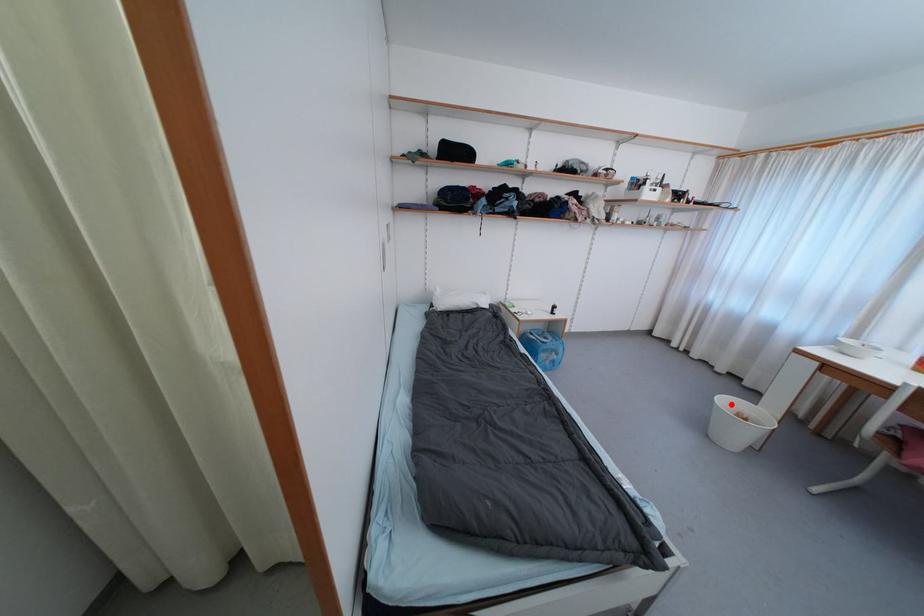
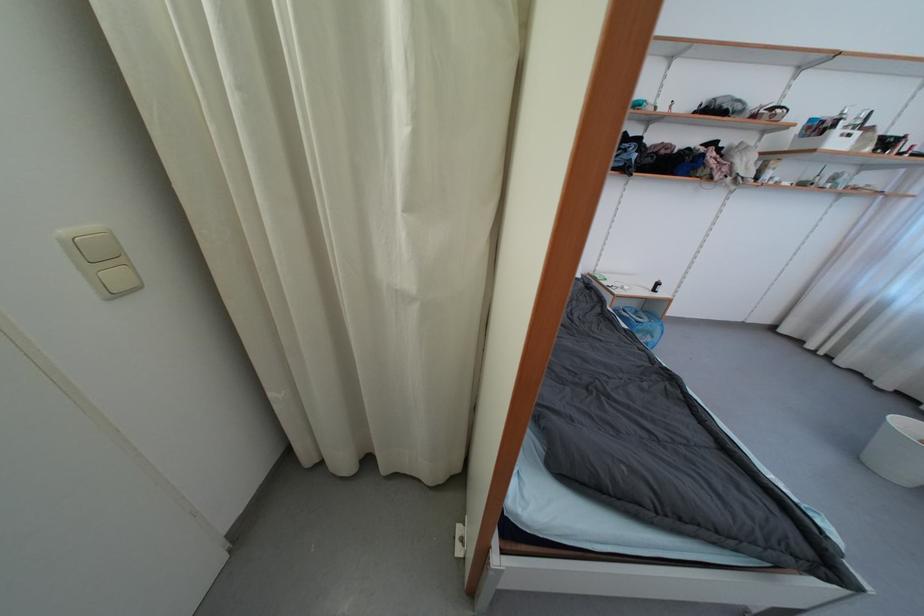
The point at the highlighted location is marked in the first image. Where is the corresponding point in the second image?

(912, 428)